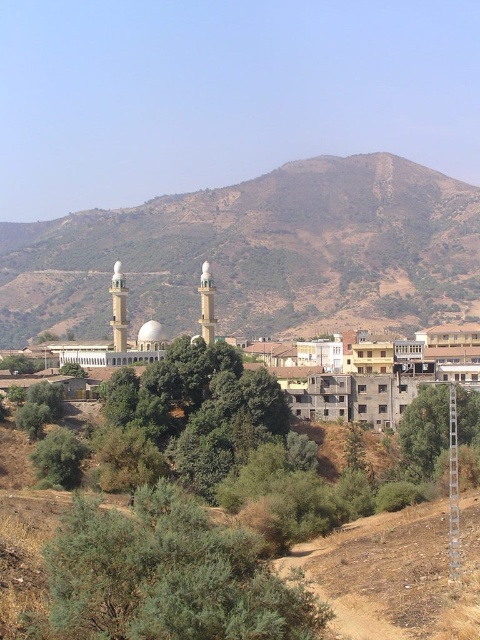
You are standing at the start of the dirt path in the foreground and want to walk towards the mosque in the midground. Which object, the green leafy bush at lower center or the green leafy tree at center, would you encounter first along the path?

The green leafy bush at lower center is to the left of the green leafy tree at center, so you would encounter the green leafy bush at lower center first as you walk along the path towards the mosque.